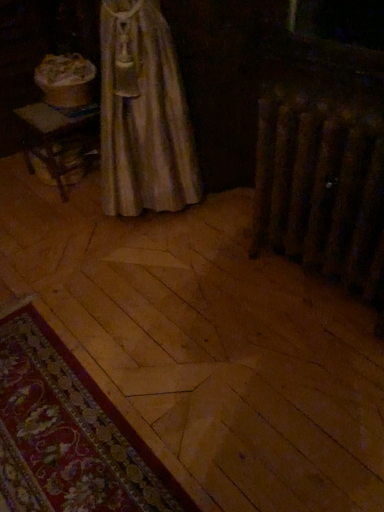
Locate an element on the screen. free space in front of rusty metal radiator at right is located at coordinates (314, 367).